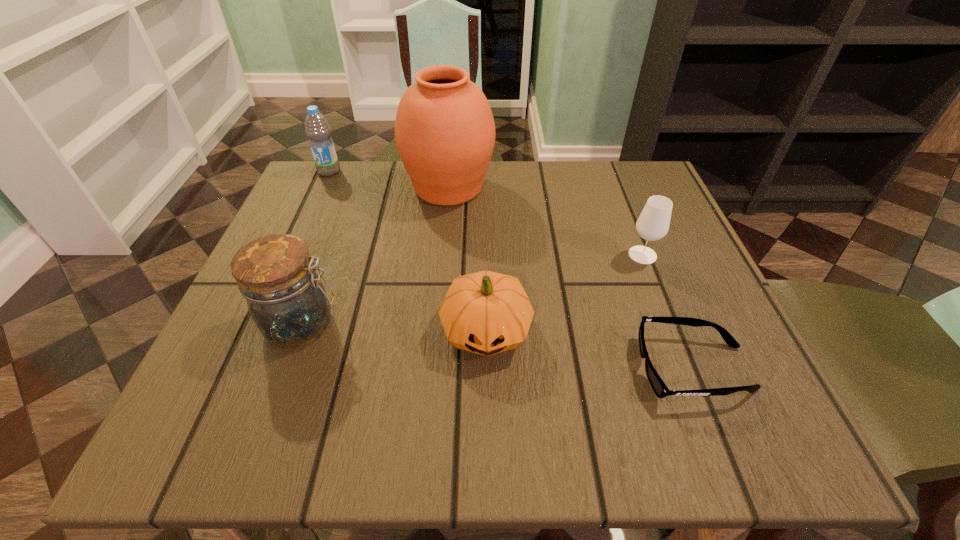
Where is `free space that satisfies the following two spatial constraints: 1. on the front side of the urn; 2. on the left side of the glass`? This screenshot has height=540, width=960. free space that satisfies the following two spatial constraints: 1. on the front side of the urn; 2. on the left side of the glass is located at coordinates (443, 255).